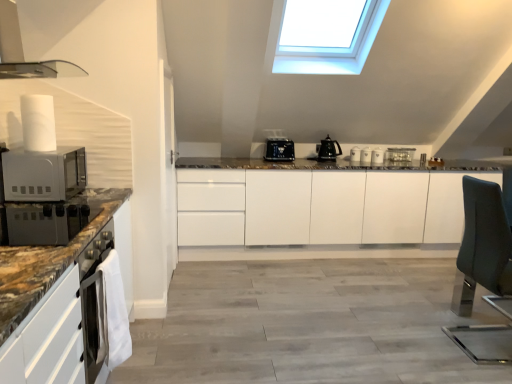
The image size is (512, 384). Identify the location of free spot to the left of teal fabric swivel chair at right. (413, 340).